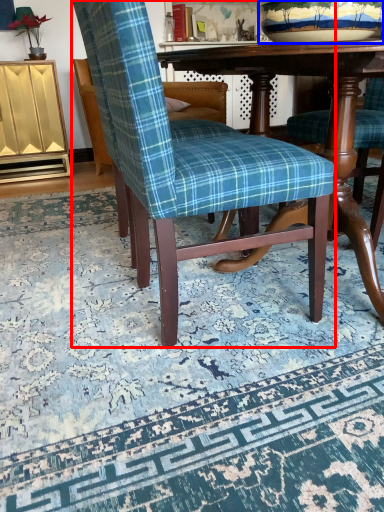
Question: Which object is closer to the camera taking this photo, chair (highlighted by a red box) or bowl (highlighted by a blue box)?

Choices:
 (A) chair
 (B) bowl

Answer: (A)